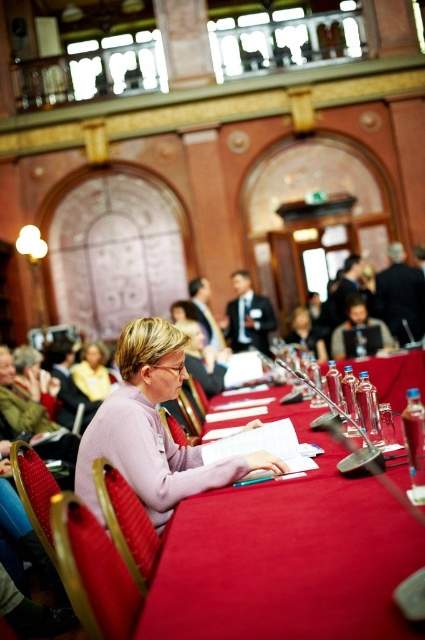
You are sitting at the table in the grand hall and want to reach an item located at point (367, 621) and another at point (172, 445). Which item would you need to reach for first if you want to pick up the one closer to you?

Point (172, 445) is closer to you than point (367, 621), so you should reach for point (172, 445) first.

You are standing at the entrance of the grand hall and want to find the smooth red table at center. According to the coordinates provided, in which direction should you look to locate it?

The smooth red table at center is located at coordinates point (286, 557), which means it is positioned towards the lower right of the image from your perspective at the entrance.

You are attending a conference in this grand hall and notice the smooth red table at center and the pink matte sweater at center. Which object is positioned closer to you?

The smooth red table at center is closer to the viewer than the pink matte sweater at center.